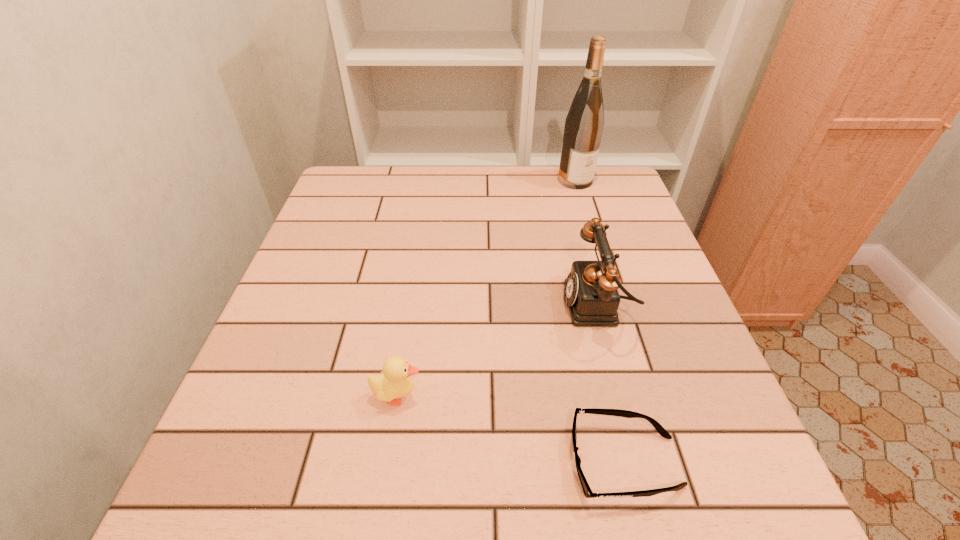
Where is `free location located on the front of the second farthest object at the rotary dial`? This screenshot has width=960, height=540. free location located on the front of the second farthest object at the rotary dial is located at coordinates (425, 306).

Where is `vacant space located on the front of the second farthest object at the rotary dial`? The height and width of the screenshot is (540, 960). vacant space located on the front of the second farthest object at the rotary dial is located at coordinates (382, 306).

This screenshot has width=960, height=540. Identify the location of vacant point located on the front-facing side of the second nearest object. (584, 395).

You are a GUI agent. You are given a task and a screenshot of the screen. Output one action in this format:
    pyautogui.click(x=<x>, y=<y>)
    Task: Click on the free spot located on the front-facing side of the nearest object
    
    Given the screenshot: What is the action you would take?
    pyautogui.click(x=364, y=462)

Locate an element on the screen. free space located 0.250m on the front-facing side of the nearest object is located at coordinates coord(409,462).

The height and width of the screenshot is (540, 960). I want to click on free space located on the front-facing side of the nearest object, so click(331, 462).

Where is `object positioned at the far edge`? object positioned at the far edge is located at coordinates (584, 123).

Where is `object that is at the near edge`? This screenshot has height=540, width=960. object that is at the near edge is located at coordinates (588, 493).

Where is `wine bottle that is at the right edge`? The image size is (960, 540). wine bottle that is at the right edge is located at coordinates (584, 123).

The width and height of the screenshot is (960, 540). I want to click on telephone at the right edge, so click(592, 296).